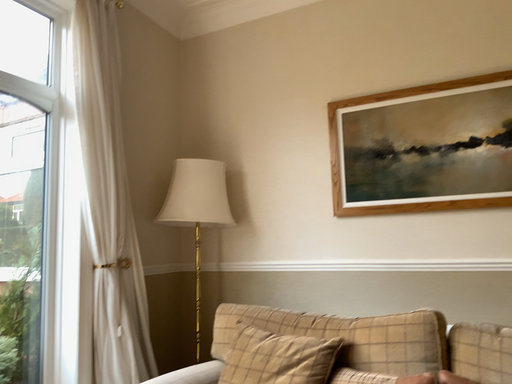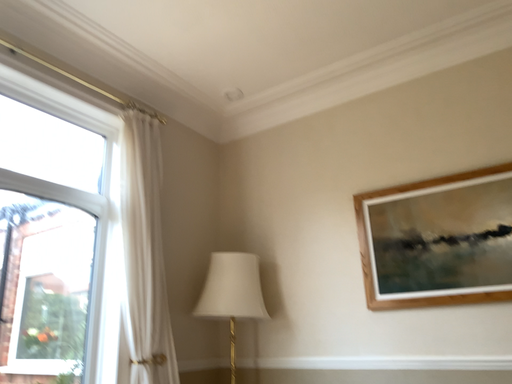
Question: Which way did the camera rotate in the video?

Choices:
 (A) rotated downward
 (B) rotated upward

Answer: (B)